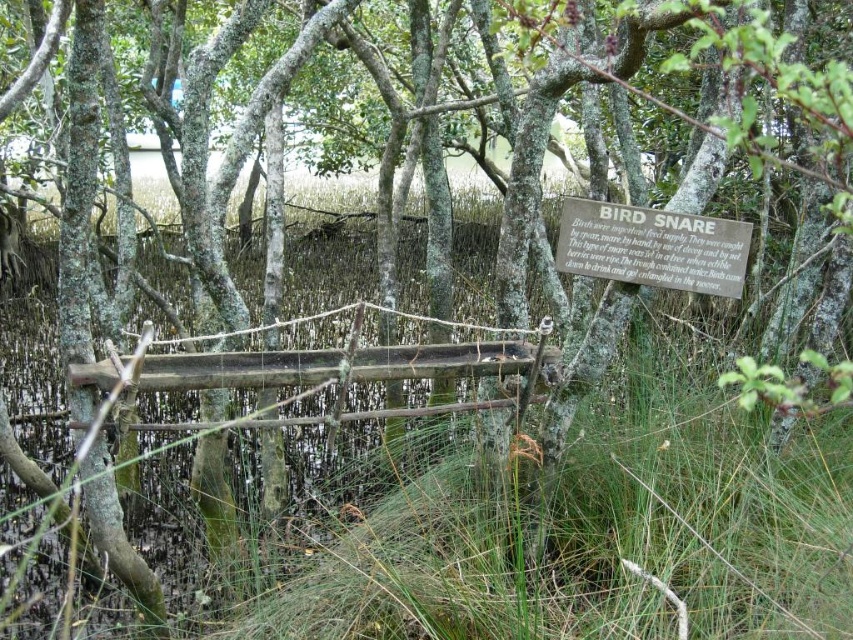
Who is more forward, (544, 356) or (728, 262)?

Point (728, 262) is in front.

Is point (212, 355) more distant than point (621, 230)?

No, it is in front of (621, 230).

What do you see at coordinates (238, 369) in the screenshot? Image resolution: width=853 pixels, height=640 pixels. I see `smooth wooden plank at center` at bounding box center [238, 369].

Where is `smooth wooden plank at center`? Image resolution: width=853 pixels, height=640 pixels. smooth wooden plank at center is located at coordinates (238, 369).